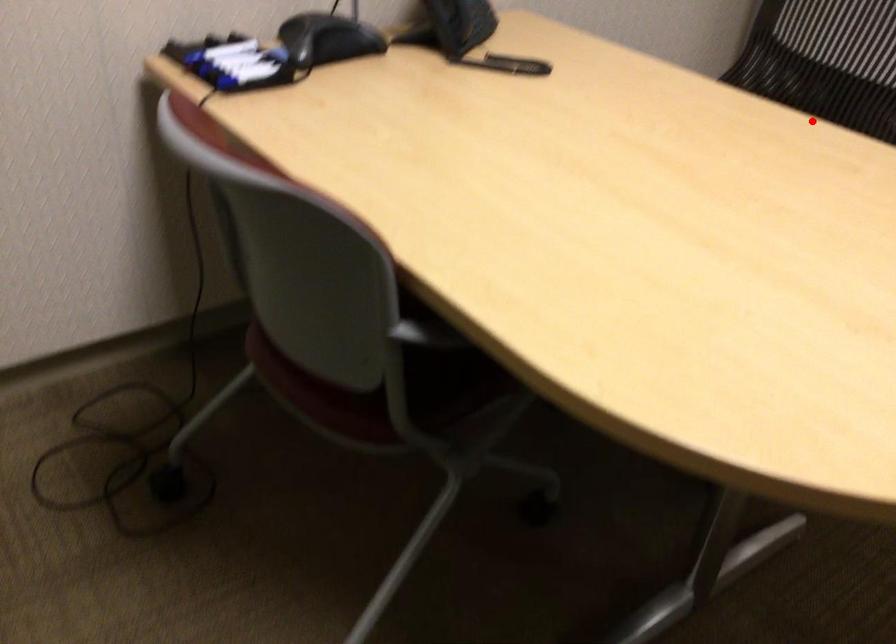
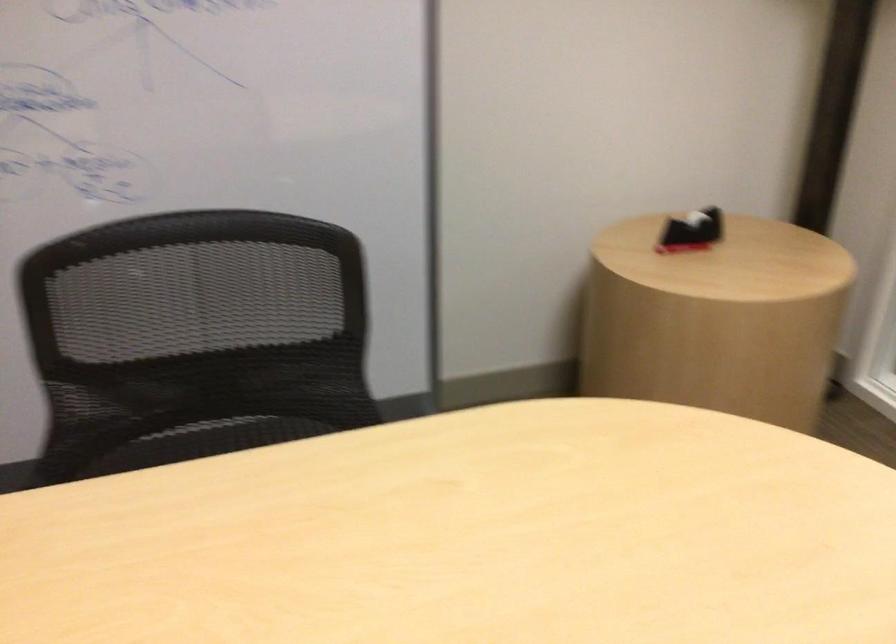
Question: I am providing you with two images of the same scene from different viewpoints. In image1, a red point is highlighted. Considering the same 3D point in image2, which of the following is correct?

Choices:
 (A) It is closer
 (B) It is farther

Answer: (A)